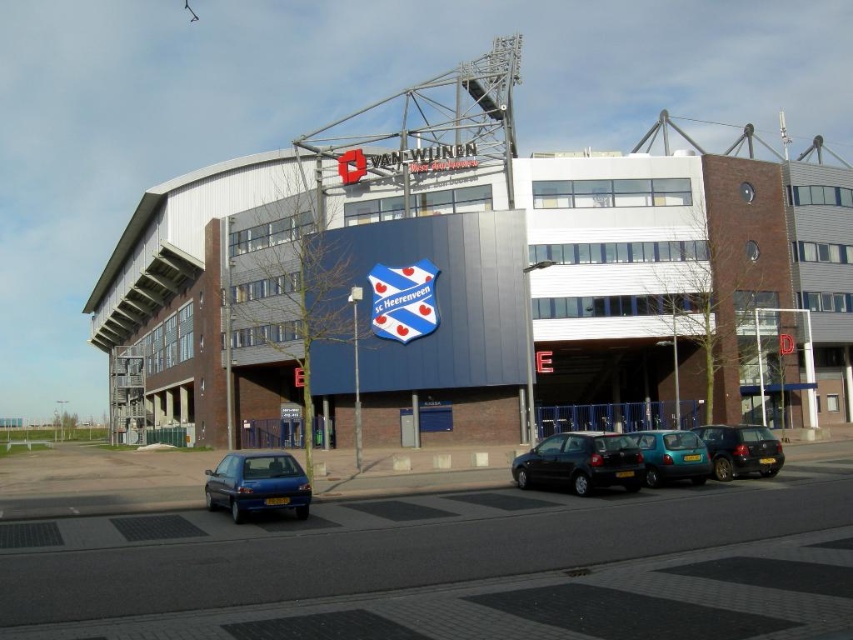
You are a photographer positioned at the edge of the field. You want to capture both the metallic gray stadium at center and the teal matte hatchback at center in a single shot. Which object should you frame first to ensure both are in the shot?

The metallic gray stadium at center is to the left of the teal matte hatchback at center, so you should frame the metallic gray stadium at center first to ensure both are included in the shot.

You are a photographer planning to take a photo of the SC Heerenveen stadium. You need to include both the blue metallic car at lower left and the teal matte hatchback at center in your shot. Which car should you position closer to the camera to ensure both are fully visible in the frame?

You should position the blue metallic car at lower left closer to the camera because it is much taller than the teal matte hatchback at center. This way, the taller car won not block the view of the smaller one.

You are a delivery driver who needs to park your vehicle in the stadium parking lot. You see a blue metallic car at lower left and a teal matte hatchback at center. If your vehicle is 15 feet long, can you safely park between these two vehicles without overlapping them?

The distance between the blue metallic car at lower left and the teal matte hatchback at center is 36.51 feet. Since your vehicle is only 15 feet long, there is sufficient space to park between them without overlapping.